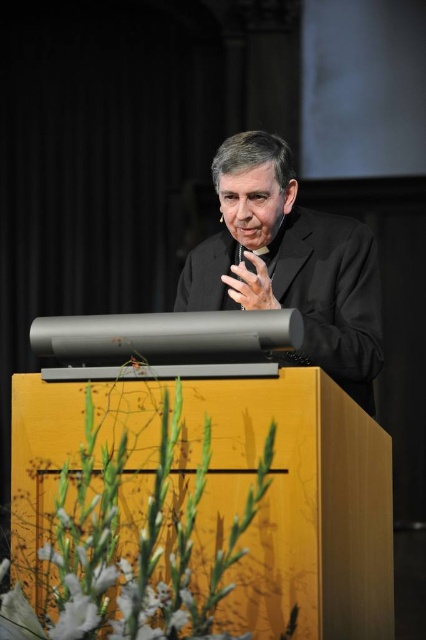
Between point (25, 497) and point (293, 364), which one is positioned behind?

The point (293, 364) is more distant.

Between point (14, 576) and point (255, 211), which one is positioned in front?

Point (14, 576) is in front.

Which is in front, point (29, 436) or point (241, 154)?

Point (29, 436)

This screenshot has width=426, height=640. What are the coordinates of `yellow wood podium at center` in the screenshot? It's located at (290, 506).